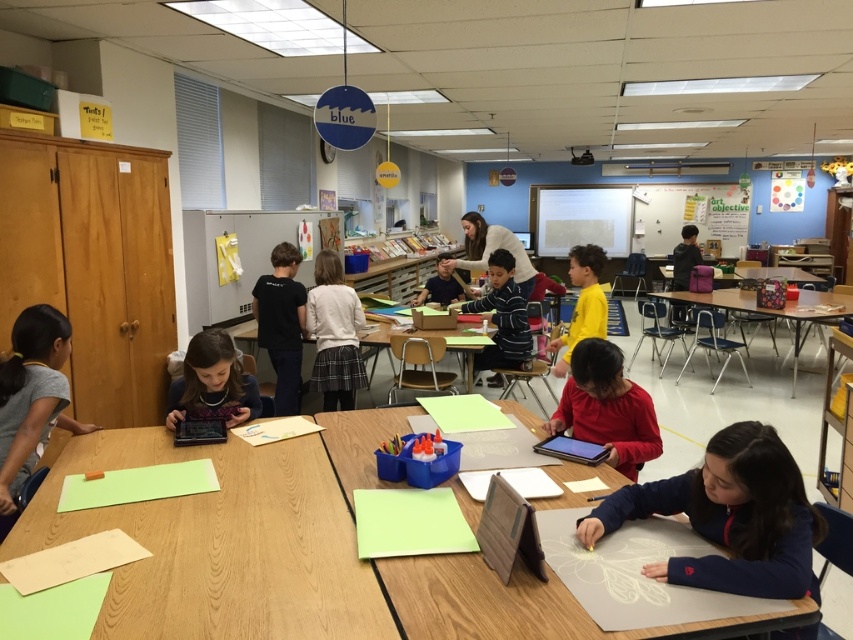
Question: Which point is closer to the camera taking this photo?

Choices:
 (A) (167, 513)
 (B) (427, 285)
 (C) (656, 212)
 (D) (566, 384)

Answer: (A)

Question: Estimate the real-world distances between objects in this image. Which object is farther from the green paper at center?

Choices:
 (A) wooden table at center
 (B) matte black shirt at center
 (C) smooth beige sweater at center

Answer: (A)

Question: Which object appears farthest from the camera in this image?

Choices:
 (A) yellow matte shirt at center
 (B) matte black tablet at lower left

Answer: (A)

Question: Where is navy blue fleece jacket at lower right located in relation to white matte sweater at center in the image?

Choices:
 (A) left
 (B) right

Answer: (B)

Question: Does gray fabric shirt at left appear on the left side of green paper at center?

Choices:
 (A) no
 (B) yes

Answer: (B)

Question: Is whiteboard at upper center wider than white matte sweater at center?

Choices:
 (A) yes
 (B) no

Answer: (A)